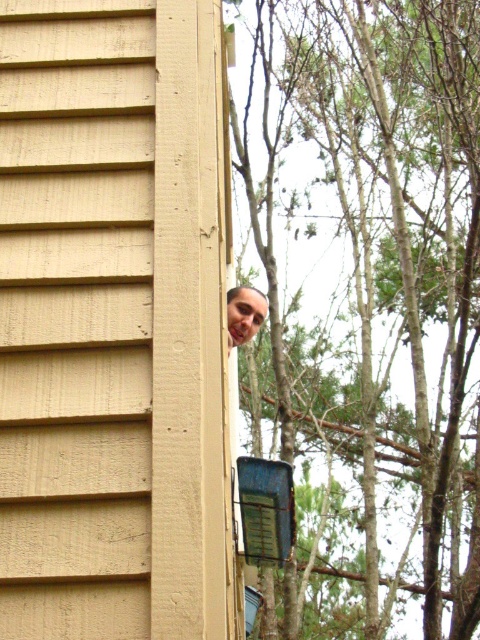
Is green leafy tree at upper right above matte brown hair at upper right?

Yes.

Between green leafy tree at upper right and matte brown hair at upper right, which one is positioned lower?

matte brown hair at upper right is below.

Where is `green leafy tree at upper right`? Image resolution: width=480 pixels, height=640 pixels. green leafy tree at upper right is located at coordinates (384, 243).